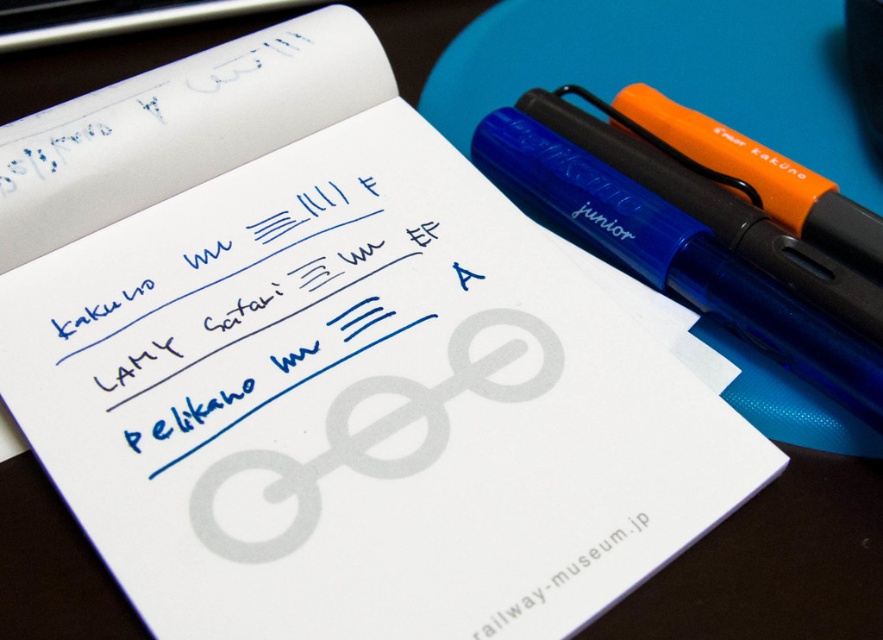
You are organizing a stationery display and need to know the relative sizes of the items. Which object is larger when comparing the blue ink writing at center and the orange matte pen at upper right?

The orange matte pen at upper right is larger than the blue ink writing at center.